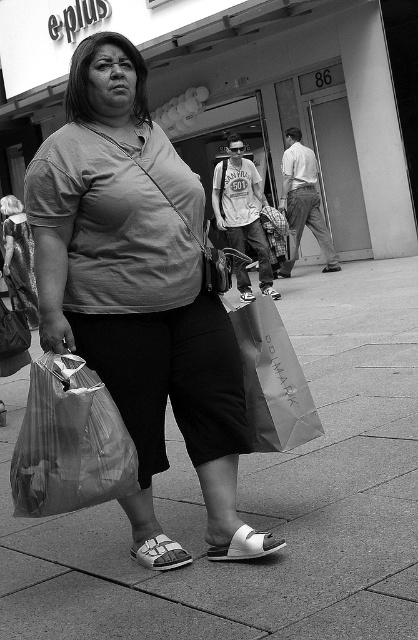
You are a delivery person trying to deliver a package to the woman in the image. You have to place the package between the translucent plastic bag at lower left and the matte paper bag at center. The package is 36 inches long. Will it fit in the space between them?

The distance between the translucent plastic bag at lower left and the matte paper bag at center is 34.03 inches. Since the package is 36 inches long, it is longer than the available space. Therefore, the package will not fit between them.

You are standing at the position of the photographer who took this black and white photo. You want to zoom in on the translucent plastic bag at lower left. Is the bag close enough to the camera for you to see its contents clearly?

The translucent plastic bag at lower left is 9.17 feet away from the camera. Since it is a black and white photo and the bag is translucent, the contents may be somewhat visible through the bag if the lighting is good. However, at this distance, details might be slightly blurry unless the camera has a high zoom capability.